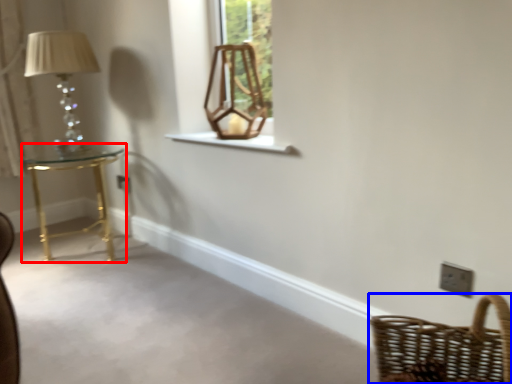
Question: Which object appears farthest to the camera in this image, table (highlighted by a red box) or basket (highlighted by a blue box)?

Choices:
 (A) table
 (B) basket

Answer: (A)